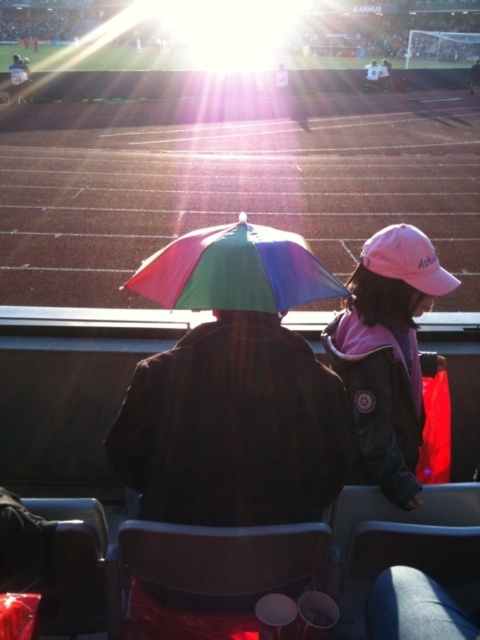
Who is taller, rainbow umbrella at center or pink fabric cap at upper right?

rainbow umbrella at center

Find the location of a particular element. rainbow umbrella at center is located at coordinates (276, 401).

The height and width of the screenshot is (640, 480). I want to click on rainbow umbrella at center, so click(x=276, y=401).

Locate an element on the screen. The image size is (480, 640). rainbow umbrella at center is located at coordinates (276, 401).

Is point (216, 298) in front of point (20, 93)?

Yes, it is.

What do you see at coordinates (235, 269) in the screenshot? I see `rainbow fabric umbrella at center` at bounding box center [235, 269].

The height and width of the screenshot is (640, 480). I want to click on rainbow fabric umbrella at center, so click(x=235, y=269).

Is pink fabric cap at upper right shorter than matte black jacket at upper left?

Correct, pink fabric cap at upper right is not as tall as matte black jacket at upper left.

Is pink fabric cap at upper right thinner than matte black jacket at upper left?

Yes, pink fabric cap at upper right is thinner than matte black jacket at upper left.

Is point (373, 476) less distant than point (28, 74)?

That is True.

Find the location of a particular element. The image size is (480, 640). pink fabric cap at upper right is located at coordinates (388, 353).